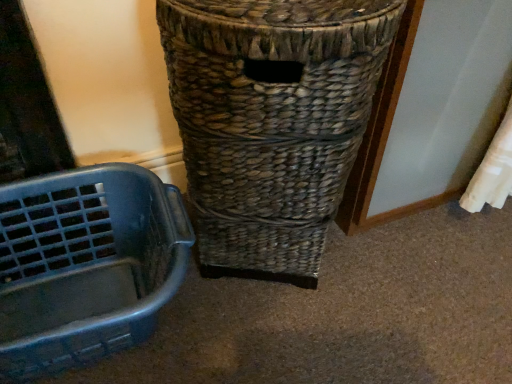
Describe the element at coordinates (86, 264) in the screenshot. Image resolution: width=512 pixels, height=384 pixels. I see `blue plastic basket at left` at that location.

At what (x,y) coordinates should I click in order to perform the action: click on blue plastic basket at left. Please return your answer as a coordinate pair (x, y). This screenshot has height=384, width=512. Looking at the image, I should click on (86, 264).

Where is `woven brown basket at center`? This screenshot has height=384, width=512. woven brown basket at center is located at coordinates (271, 121).

The height and width of the screenshot is (384, 512). Describe the element at coordinates (271, 121) in the screenshot. I see `woven brown basket at center` at that location.

Identify the location of blue plastic basket at left. The width and height of the screenshot is (512, 384). (86, 264).

Based on their positions, is blue plastic basket at left located to the left or right of woven brown basket at center?

From the image, it's evident that blue plastic basket at left is to the left of woven brown basket at center.

Between blue plastic basket at left and woven brown basket at center, which one is positioned in front?

woven brown basket at center is more forward.

Between point (120, 243) and point (201, 179), which one is positioned in front?

The point (201, 179) is closer.

In the scene shown: From the image's perspective, would you say blue plastic basket at left is shown under woven brown basket at center?

Yes, from the image's perspective, blue plastic basket at left is below woven brown basket at center.

From a real-world perspective, does blue plastic basket at left stand above woven brown basket at center?

Incorrect, from a real-world perspective, blue plastic basket at left is lower than woven brown basket at center.

In terms of width, does blue plastic basket at left look wider or thinner when compared to woven brown basket at center?

blue plastic basket at left is thinner than woven brown basket at center.

Considering the sizes of objects blue plastic basket at left and woven brown basket at center in the image provided, who is taller, blue plastic basket at left or woven brown basket at center?

Standing taller between the two is woven brown basket at center.

From the picture: Based on their sizes in the image, would you say blue plastic basket at left is bigger or smaller than woven brown basket at center?

Considering their sizes, blue plastic basket at left takes up less space than woven brown basket at center.

Do you think blue plastic basket at left is within woven brown basket at center, or outside of it?

blue plastic basket at left is outside woven brown basket at center.

From the picture: Does blue plastic basket at left touch woven brown basket at center?

There is a gap between blue plastic basket at left and woven brown basket at center.

Could you tell me if blue plastic basket at left is facing woven brown basket at center?

No.

Looking at this image, measure the distance between blue plastic basket at left and woven brown basket at center.

They are 10.59 inches apart.

At what (x,y) coordinates should I click in order to perform the action: click on waste container in front of the blue plastic basket at left. Please return your answer as a coordinate pair (x, y). The image size is (512, 384). Looking at the image, I should click on (271, 121).

Considering the relative positions of woven brown basket at center and blue plastic basket at left in the image provided, is woven brown basket at center to the left or to the right of blue plastic basket at left?

Based on their positions, woven brown basket at center is located to the right of blue plastic basket at left.

Considering the positions of objects woven brown basket at center and blue plastic basket at left in the image provided, who is in front, woven brown basket at center or blue plastic basket at left?

Positioned in front is woven brown basket at center.

Which is in front, point (258, 71) or point (1, 200)?

The point (258, 71) is in front.

From the image's perspective, is woven brown basket at center located beneath blue plastic basket at left?

No, from the image's perspective, woven brown basket at center is not beneath blue plastic basket at left.

In the scene shown: From a real-world perspective, which is physically above, woven brown basket at center or blue plastic basket at left?

woven brown basket at center, from a real-world perspective.

Is woven brown basket at center wider than blue plastic basket at left?

Yes.

Between woven brown basket at center and blue plastic basket at left, which one has less height?

Standing shorter between the two is blue plastic basket at left.

Based on their sizes in the image, would you say woven brown basket at center is bigger or smaller than blue plastic basket at left?

Clearly, woven brown basket at center is larger in size than blue plastic basket at left.

Is blue plastic basket at left surrounded by woven brown basket at center?

Definitely not — blue plastic basket at left is not inside woven brown basket at center.

Looking at this image, is woven brown basket at center placed right next to blue plastic basket at left?

No.

Does woven brown basket at center turn towards blue plastic basket at left?

No, woven brown basket at center is not oriented towards blue plastic basket at left.

How far apart are woven brown basket at center and blue plastic basket at left?

10.59 inches.

Where is `waste container in front of the blue plastic basket at left`? This screenshot has height=384, width=512. waste container in front of the blue plastic basket at left is located at coordinates [271, 121].

Where is `basket container lying below the woven brown basket at center (from the image's perspective)`? The image size is (512, 384). basket container lying below the woven brown basket at center (from the image's perspective) is located at coordinates coord(86,264).

I want to click on waste container in front of the blue plastic basket at left, so point(271,121).